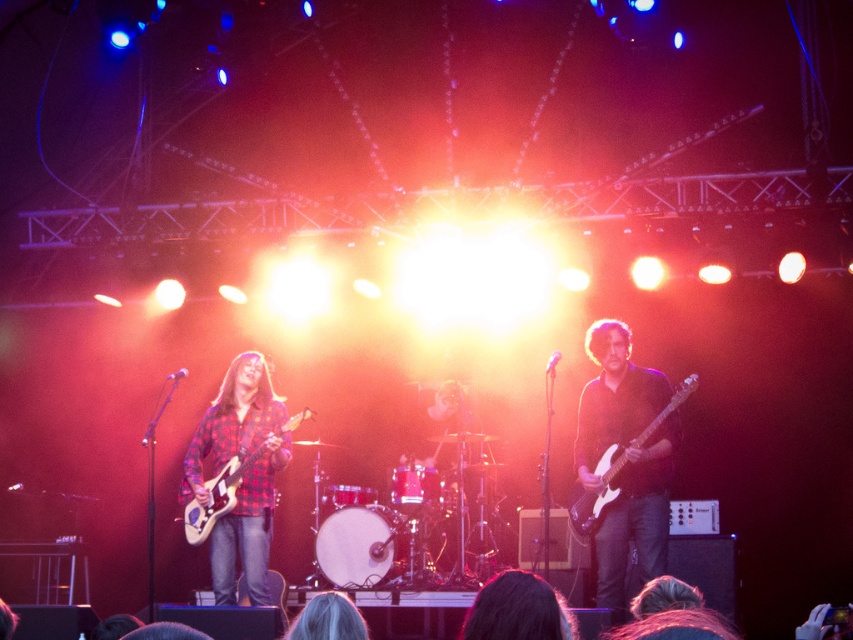
You are a stagehand adjusting the lighting for the performance. You notice two white items on stage. Which item is shorter between the white drumhead at center and the white glossy electric guitar at right?

The white drumhead at center is shorter than the white glossy electric guitar at right.

You are a stagehand who needs to place a new microphone stand between the white glossy electric guitar at right and the plaid fabric guitar at left. Since the stand requires 1 meter of space, can you fit it between them?

The white glossy electric guitar at right is narrower than the plaid fabric guitar at left. However, the total space between them isn

You are a stagehand adjusting the lighting for the performance. You need to position a new spotlight so it shines between the two points on stage, point (323, 522) and point (618, 456). Which point should the spotlight be placed closer to in order to ensure the light reaches both points without obstruction?

The spotlight should be placed closer to point (618, 456) because point (323, 522) is behind it, so positioning closer to the front point ensures the light can reach both without obstruction.